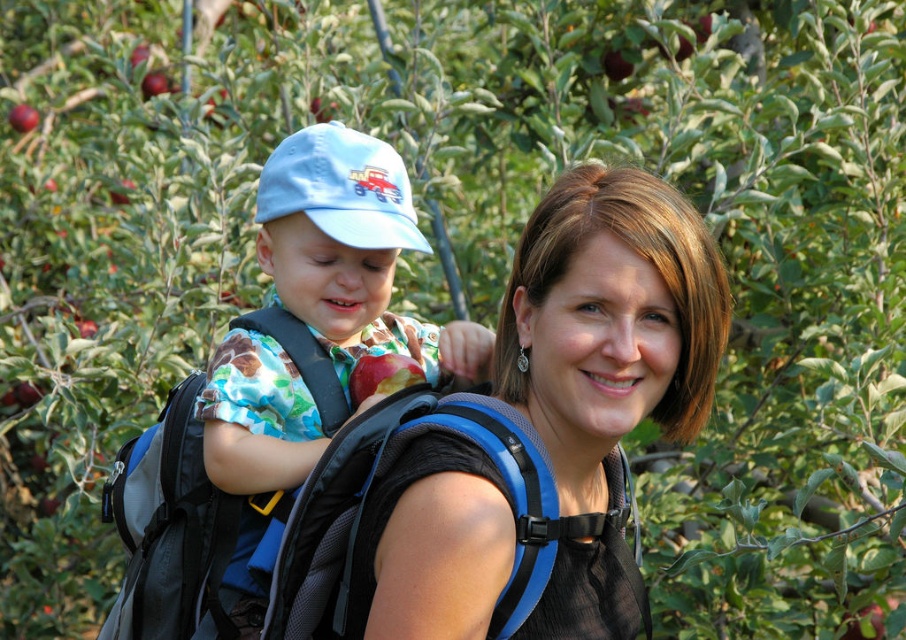
You are planning to take a photo of the matte black backpack at center and the matte blue cap at upper left. Which object is shorter in height?

The matte black backpack at center is not as tall as the matte blue cap at upper left, so the matte black backpack at center is shorter in height.

You are planning to place the matte black backpack at center and the red matte apple at center into a box that can only hold items narrower than the backpack. Which item should you choose?

The red matte apple at center should be chosen because it is narrower than the matte black backpack at center, so it will fit into the box.

You are planning to pack both the matte blue cap at upper left and the red matte apple at center into a small bag that can only fit items narrower than the apple. Which item will not fit?

The matte blue cap at upper left will not fit because its width is larger than the red matte apple at center.